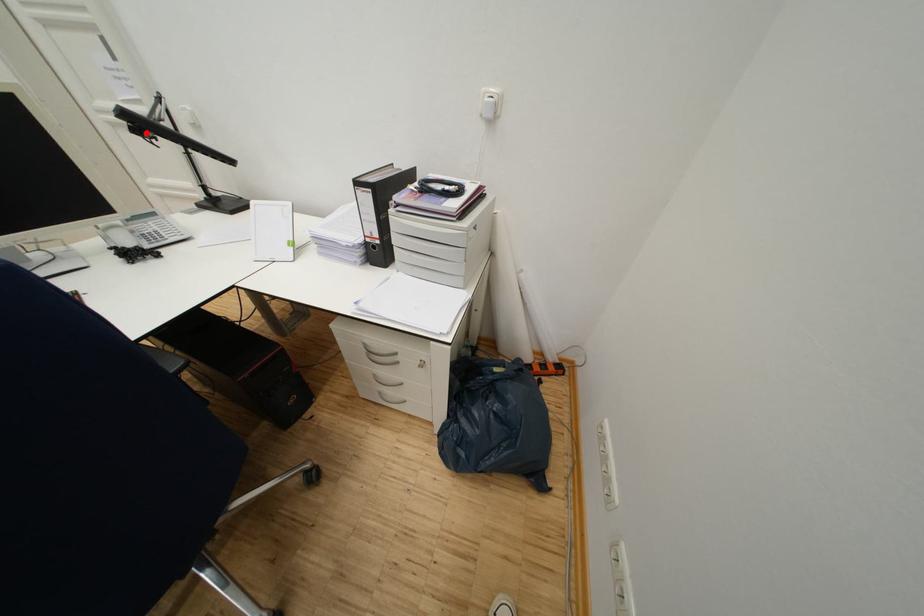
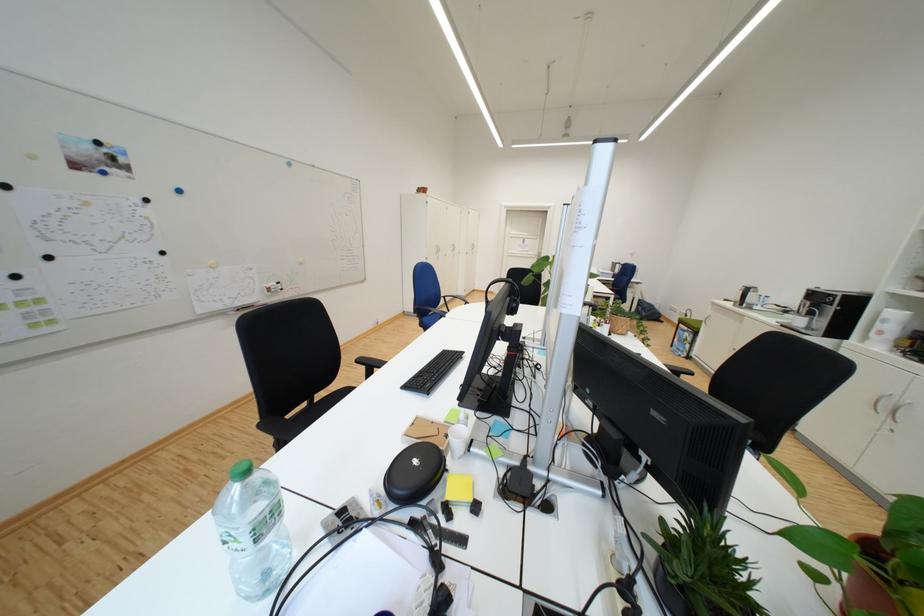
Question: I am providing you with two images of the same scene from different viewpoints. A red point is marked on the first image. Is the red point's position out of view in image 2?

Choices:
 (A) Yes
 (B) No

Answer: (A)